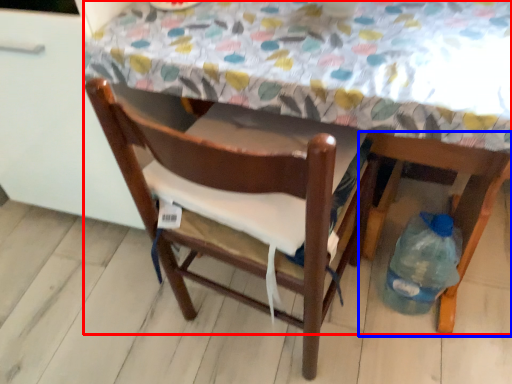
Question: Which object is closer to the camera taking this photo, table (highlighted by a red box) or chair (highlighted by a blue box)?

Choices:
 (A) table
 (B) chair

Answer: (A)